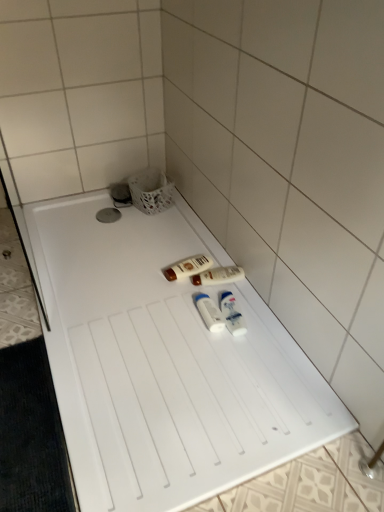
The height and width of the screenshot is (512, 384). Identify the location of free location above white plastic tray at center (from a real-world perspective). (148, 327).